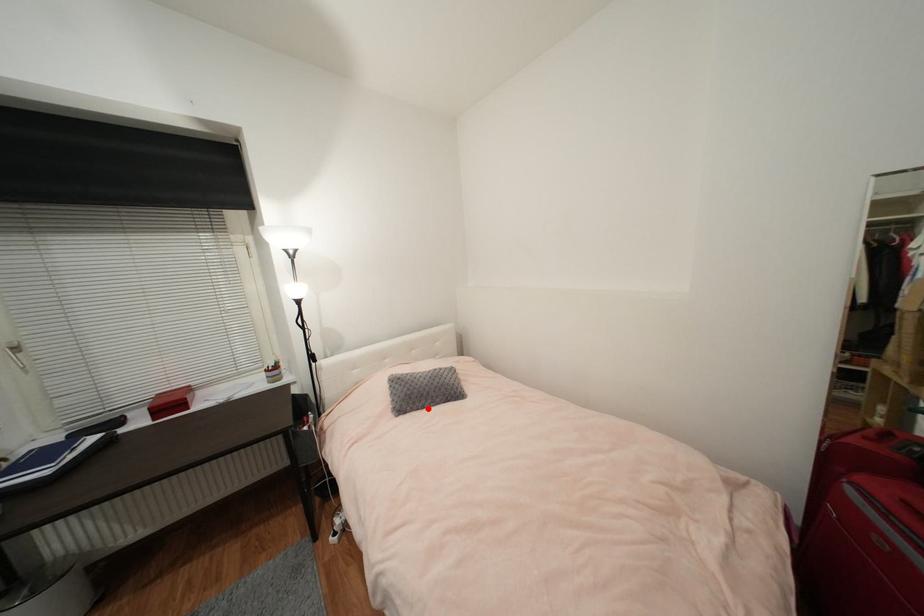
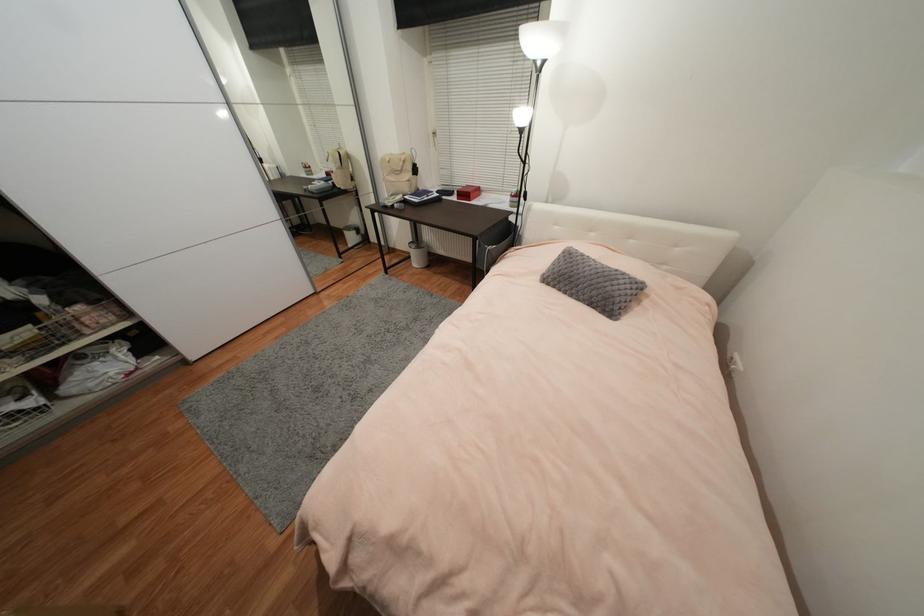
Find the pixel in the second image that matches the highlighted location in the first image.

(569, 294)